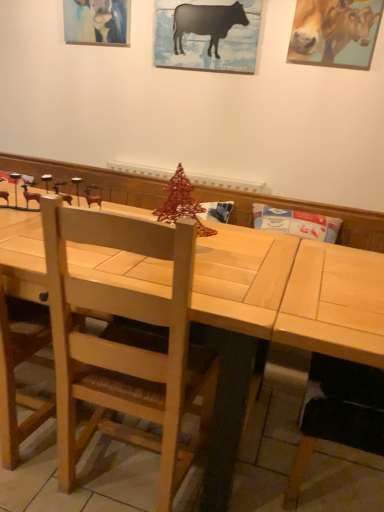
The image size is (384, 512). In order to click on light brown wooden chair at center in this screenshot , I will do `click(126, 344)`.

You are a GUI agent. You are given a task and a screenshot of the screen. Output one action in this format:
    pyautogui.click(x=<x>, y=<y>)
    Task: Click on the matte acrylic painting at upper left
    
    Given the screenshot: What is the action you would take?
    pyautogui.click(x=97, y=21)

The height and width of the screenshot is (512, 384). Describe the element at coordinates (207, 22) in the screenshot. I see `black matte/ceramic cow at upper center, which ranks as the 1th cattle in left-to-right order` at that location.

This screenshot has width=384, height=512. Find the location of `golden glossy cow at upper right, which is the 1th cattle from right to left`. golden glossy cow at upper right, which is the 1th cattle from right to left is located at coordinates (329, 28).

The width and height of the screenshot is (384, 512). In order to click on light wood table at center in this screenshot , I will do `click(278, 318)`.

The height and width of the screenshot is (512, 384). I want to click on light brown wooden chair at center, so click(126, 344).

Is light brown wooden chair at center not near golden glossy cow at upper right, which is the 1th cattle from right to left?

Yes, light brown wooden chair at center and golden glossy cow at upper right, which is the 1th cattle from right to left, are located far from each other.

From a real-world perspective, which object rests below the other?

From a 3D spatial view, light brown wooden chair at center is below.

Looking at this image, how different are the orientations of light brown wooden chair at center and golden glossy cow at upper right, the second cattle positioned from the left, in degrees?

179 degrees separate the facing orientations of light brown wooden chair at center and golden glossy cow at upper right, the second cattle positioned from the left.

From the picture: From a real-world perspective, is black matte/ceramic cow at upper center, the second cattle when ordered from right to left, above or below matte acrylic painting at upper left?

From a real-world perspective, black matte/ceramic cow at upper center, the second cattle when ordered from right to left, is physically below matte acrylic painting at upper left.

Does black matte/ceramic cow at upper center, the second cattle when ordered from right to left, have a greater width compared to matte acrylic painting at upper left?

In fact, black matte/ceramic cow at upper center, the second cattle when ordered from right to left, might be narrower than matte acrylic painting at upper left.

Is black matte/ceramic cow at upper center, the second cattle when ordered from right to left, oriented away from matte acrylic painting at upper left?

black matte/ceramic cow at upper center, the second cattle when ordered from right to left, is not turned away from matte acrylic painting at upper left.

Is matte acrylic painting at upper left at the left side of light wood table at center?

Yes.

Are matte acrylic painting at upper left and light wood table at center far apart?

That's right, there is a large distance between matte acrylic painting at upper left and light wood table at center.

In the image, is matte acrylic painting at upper left positioned in front of or behind light wood table at center?

Clearly, matte acrylic painting at upper left is behind light wood table at center.

Can you confirm if matte acrylic painting at upper left is shorter than light wood table at center?

Correct, matte acrylic painting at upper left is not as tall as light wood table at center.

Is matte acrylic painting at upper left not within golden glossy cow at upper right, the second cattle positioned from the left?

Yes, matte acrylic painting at upper left is located beyond the bounds of golden glossy cow at upper right, the second cattle positioned from the left.

From a real-world perspective, which object rests below the other?

In real-world perspective, matte acrylic painting at upper left is lower.

Between matte acrylic painting at upper left and golden glossy cow at upper right, which is the 1th cattle from right to left, which one has larger width?

Wider between the two is matte acrylic painting at upper left.

Could you tell me if matte acrylic painting at upper left is turned towards golden glossy cow at upper right, the second cattle positioned from the left?

No, matte acrylic painting at upper left is not facing towards golden glossy cow at upper right, the second cattle positioned from the left.

Considering the positions of objects light wood table at center and light brown wooden chair at center in the image provided, who is more to the left, light wood table at center or light brown wooden chair at center?

light wood table at center is more to the left.

Is light wood table at center facing away from light brown wooden chair at center?

Correct, light wood table at center is looking away from light brown wooden chair at center.

Does light wood table at center have a larger size compared to light brown wooden chair at center?

Yes, light wood table at center is bigger than light brown wooden chair at center.

Can you confirm if matte acrylic painting at upper left is positioned to the right of light brown wooden chair at center?

Incorrect, matte acrylic painting at upper left is not on the right side of light brown wooden chair at center.

How far apart are matte acrylic painting at upper left and light brown wooden chair at center?

The distance of matte acrylic painting at upper left from light brown wooden chair at center is 1.98 meters.

Considering the sizes of matte acrylic painting at upper left and light brown wooden chair at center in the image, is matte acrylic painting at upper left taller or shorter than light brown wooden chair at center?

Considering their sizes, matte acrylic painting at upper left has less height than light brown wooden chair at center.

Is point (97, 13) closer to viewer compared to point (128, 246)?

No, (97, 13) is behind (128, 246).

Does light brown wooden chair at center have a larger size compared to light wood table at center?

Actually, light brown wooden chair at center might be smaller than light wood table at center.

Based on the photo, is light brown wooden chair at center turned away from light wood table at center?

Yes, light wood table at center is at the back of light brown wooden chair at center.

Is the depth of light brown wooden chair at center greater than that of light wood table at center?

Yes.

Locate an element on the screen. The height and width of the screenshot is (512, 384). table located underneath the light brown wooden chair at center (from a real-world perspective) is located at coordinates (278, 318).

I want to click on chair on the left of golden glossy cow at upper right, which is the 1th cattle from right to left, so click(x=126, y=344).

From the matte acrylic painting at upper left, count 1st cattle to the right and point to it. Please provide its 2D coordinates.

[(207, 22)]

From the image, which object appears to be farther from golden glossy cow at upper right, which is the 1th cattle from right to left, black matte/ceramic cow at upper center, which ranks as the 1th cattle in left-to-right order, or matte acrylic painting at upper left?

matte acrylic painting at upper left.

When comparing their distances from light wood table at center, does black matte/ceramic cow at upper center, the second cattle when ordered from right to left, or light brown wooden chair at center seem closer?

light brown wooden chair at center.

Based on their spatial positions, is light wood table at center or golden glossy cow at upper right, which is the 1th cattle from right to left, further from black matte/ceramic cow at upper center, the second cattle when ordered from right to left?

The object further to black matte/ceramic cow at upper center, the second cattle when ordered from right to left, is light wood table at center.

When comparing their distances from golden glossy cow at upper right, the second cattle positioned from the left, does light wood table at center or black matte/ceramic cow at upper center, which ranks as the 1th cattle in left-to-right order, seem closer?

black matte/ceramic cow at upper center, which ranks as the 1th cattle in left-to-right order, lies closer to golden glossy cow at upper right, the second cattle positioned from the left, than the other object.

Estimate the real-world distances between objects in this image. Which object is further from light brown wooden chair at center, golden glossy cow at upper right, the second cattle positioned from the left, or black matte/ceramic cow at upper center, which ranks as the 1th cattle in left-to-right order?

Based on the image, black matte/ceramic cow at upper center, which ranks as the 1th cattle in left-to-right order, appears to be further to light brown wooden chair at center.

When comparing their distances from light brown wooden chair at center, does matte acrylic painting at upper left or black matte/ceramic cow at upper center, which ranks as the 1th cattle in left-to-right order, seem closer?

Based on the image, black matte/ceramic cow at upper center, which ranks as the 1th cattle in left-to-right order, appears to be nearer to light brown wooden chair at center.

When comparing their distances from light brown wooden chair at center, does black matte/ceramic cow at upper center, which ranks as the 1th cattle in left-to-right order, or light wood table at center seem closer?

light wood table at center.

When comparing their distances from light wood table at center, does black matte/ceramic cow at upper center, which ranks as the 1th cattle in left-to-right order, or matte acrylic painting at upper left seem closer?

black matte/ceramic cow at upper center, which ranks as the 1th cattle in left-to-right order, is closer to light wood table at center.

The image size is (384, 512). Find the location of `cattle situated between matte acrylic painting at upper left and golden glossy cow at upper right, the second cattle positioned from the left, from left to right`. cattle situated between matte acrylic painting at upper left and golden glossy cow at upper right, the second cattle positioned from the left, from left to right is located at coordinates (207, 22).

Where is `table between golden glossy cow at upper right, the second cattle positioned from the left, and light brown wooden chair at center from top to bottom`? The height and width of the screenshot is (512, 384). table between golden glossy cow at upper right, the second cattle positioned from the left, and light brown wooden chair at center from top to bottom is located at coordinates (278, 318).

Locate an element on the screen. This screenshot has width=384, height=512. cattle between black matte/ceramic cow at upper center, the second cattle when ordered from right to left, and light wood table at center, in the vertical direction is located at coordinates (329, 28).

At what (x,y) coordinates should I click in order to perform the action: click on table between black matte/ceramic cow at upper center, which ranks as the 1th cattle in left-to-right order, and light brown wooden chair at center vertically. Please return your answer as a coordinate pair (x, y). This screenshot has height=512, width=384. Looking at the image, I should click on (278, 318).